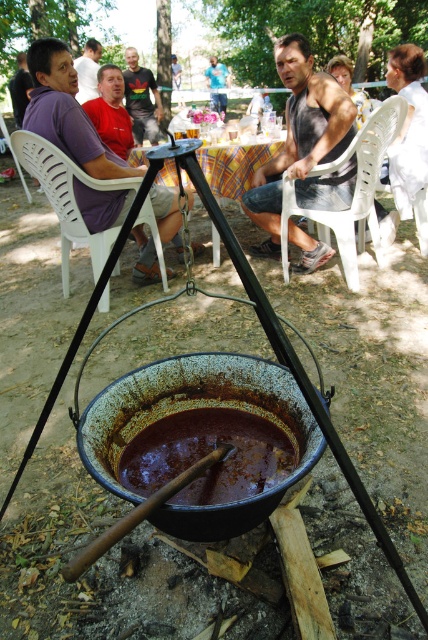
Question: Does white plastic chair at left have a larger size compared to blue denim shirt at center?

Choices:
 (A) no
 (B) yes

Answer: (A)

Question: Among these objects, which one is farthest from the camera?

Choices:
 (A) matte black shirt at upper left
 (B) yellow checkered tablecloth at center

Answer: (A)

Question: Which point appears closest to the camera in this image?

Choices:
 (A) (262, 182)
 (B) (222, 104)

Answer: (A)

Question: Does white plastic chair at left have a larger size compared to yellow checkered tablecloth at center?

Choices:
 (A) yes
 (B) no

Answer: (A)

Question: Does brown glossy pot at center have a lesser width compared to matte black shirt at upper left?

Choices:
 (A) no
 (B) yes

Answer: (A)

Question: Which object is closer to the camera taking this photo?

Choices:
 (A) white plastic chair at center
 (B) matte red shirt at center
 (C) blue denim shirt at center

Answer: (A)